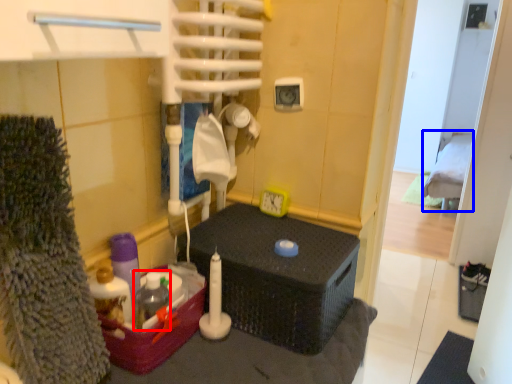
Question: Which of the following is the closest to the observer, bottle (highlighted by a red box) or bed (highlighted by a blue box)?

Choices:
 (A) bottle
 (B) bed

Answer: (A)